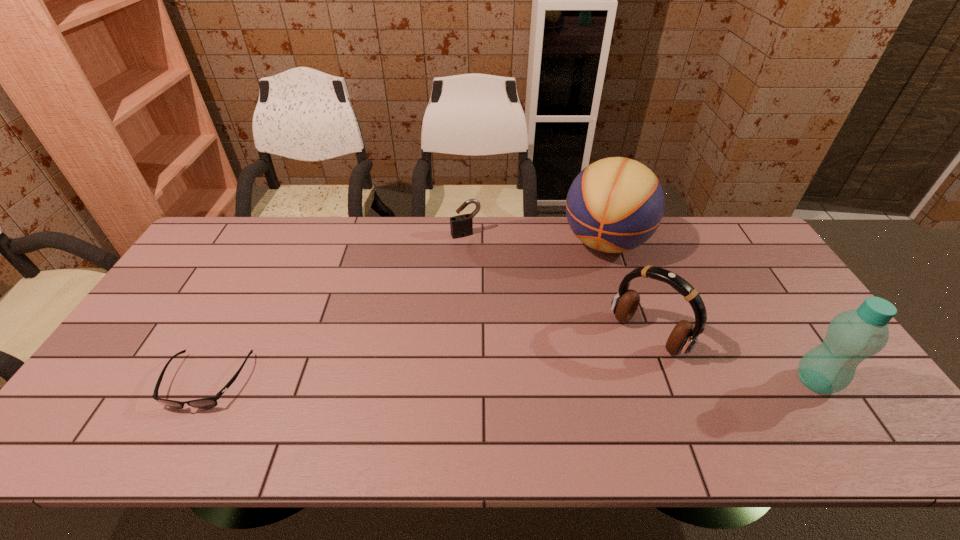
Identify which object is the fourth closest to the bottle. Please provide its 2D coordinates. Your answer should be formatted as a tuple, i.e. [(x, y)], where the tuple contains the x and y coordinates of a point satisfying the conditions above.

[(205, 403)]